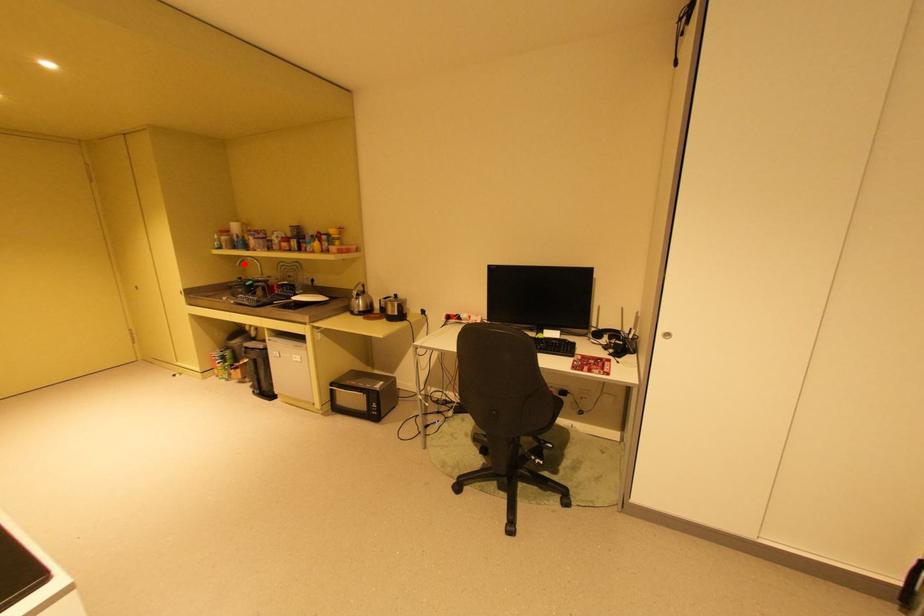
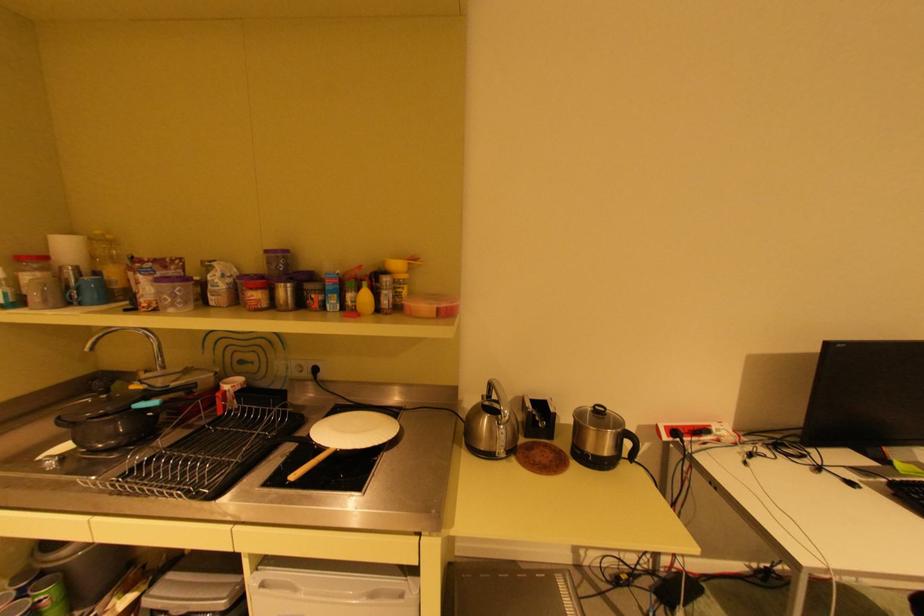
Where in the second image is the point corresponding to the highlighted location from the first image?

(92, 347)